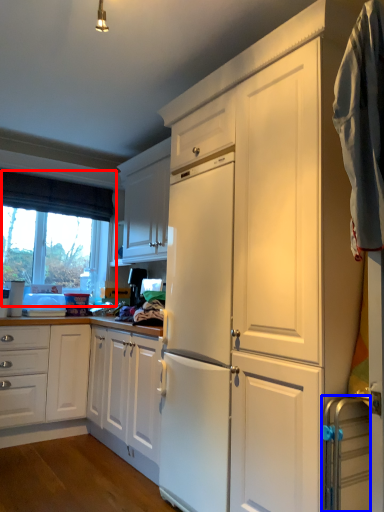
Question: Which point is closer to the camera, window (highlighted by a red box) or appliance (highlighted by a blue box)?

Choices:
 (A) window
 (B) appliance

Answer: (B)